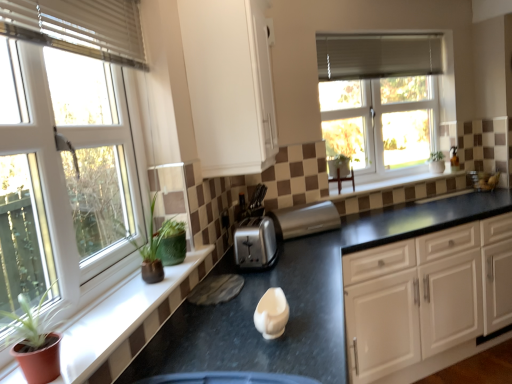
Identify the location of blank space above matte green plant at left (from a real-world perspective). (120, 305).